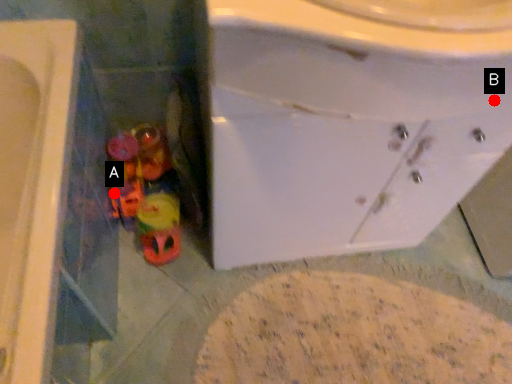
Question: Two points are circled on the image, labeled by A and B beside each circle. Which point is farther from the camera taking this photo?

Choices:
 (A) A is further
 (B) B is further

Answer: (A)